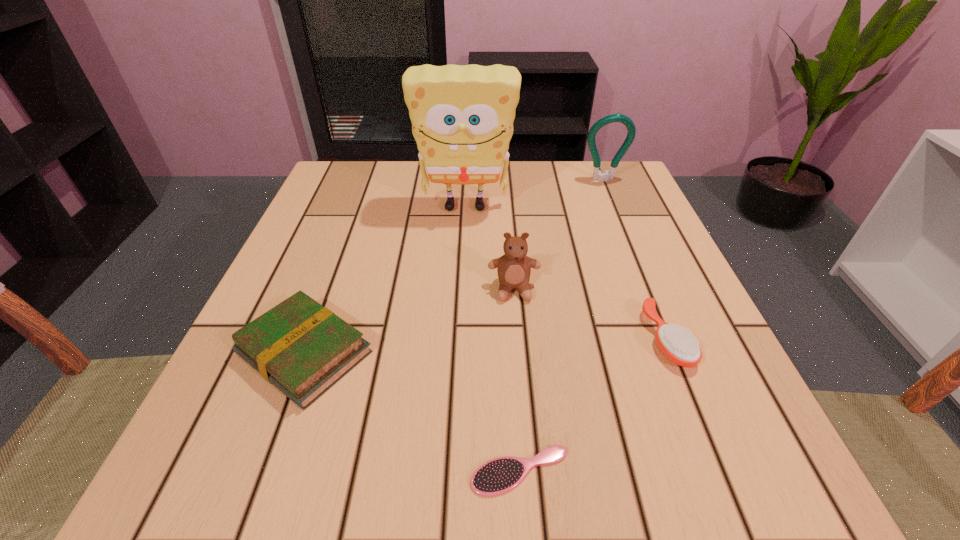
At what (x,y) coordinates should I click in order to perform the action: click on the left hairbrush. Please return your answer as a coordinate pair (x, y). This screenshot has width=960, height=540. Looking at the image, I should click on (500, 475).

You are a GUI agent. You are given a task and a screenshot of the screen. Output one action in this format:
    pyautogui.click(x=<x>, y=<y>)
    Task: Click on the free space located on the face of the sponge
    
    Given the screenshot: What is the action you would take?
    pyautogui.click(x=459, y=347)

Where is `vacant position located 0.360m at the jaws of the bottle opener`? The image size is (960, 540). vacant position located 0.360m at the jaws of the bottle opener is located at coordinates (648, 288).

I want to click on free space located 0.140m on the front-facing side of the fourth shortest object, so click(x=520, y=371).

This screenshot has height=540, width=960. In order to click on vacant area located on the back of the book in this screenshot , I will do `click(340, 258)`.

At what (x,y) coordinates should I click in order to perform the action: click on blank space located on the left of the right hairbrush. Please return your answer as a coordinate pair (x, y). The image size is (960, 540). Looking at the image, I should click on click(534, 338).

Where is `free spot located 0.160m on the left of the shorter hairbrush`? free spot located 0.160m on the left of the shorter hairbrush is located at coordinates (341, 471).

I want to click on sponge that is at the far edge, so click(462, 116).

This screenshot has width=960, height=540. Identify the location of bottle opener positioned at the far edge. (597, 174).

This screenshot has width=960, height=540. In order to click on object situated at the near edge in this screenshot , I will do `click(500, 475)`.